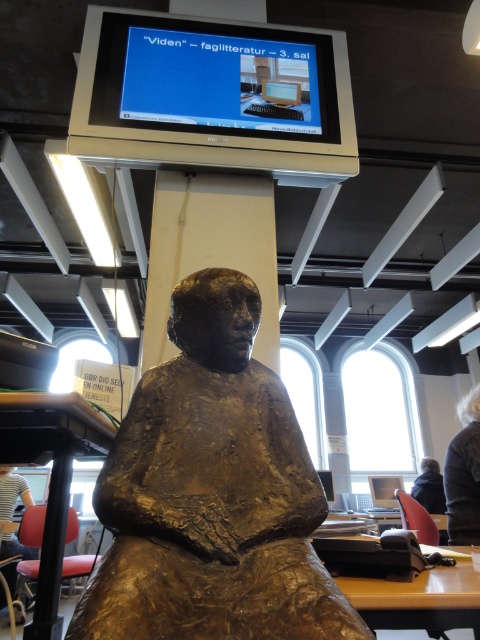
Is black matte table at lower left shorter than wooden table at lower center?

No.

Between black matte table at lower left and wooden table at lower center, which one has more height?

With more height is black matte table at lower left.

Find the location of a particular element. The height and width of the screenshot is (640, 480). black matte table at lower left is located at coordinates (50, 476).

Can you confirm if wooden table at lower center is wider than dark brown hair at lower right?

Yes, wooden table at lower center is wider than dark brown hair at lower right.

Does wooden table at lower center have a greater height compared to dark brown hair at lower right?

Incorrect, wooden table at lower center's height is not larger of dark brown hair at lower right's.

Describe the element at coordinates (400, 586) in the screenshot. Image resolution: width=480 pixels, height=640 pixels. I see `wooden table at lower center` at that location.

At what (x,y) coordinates should I click in order to perform the action: click on wooden table at lower center. Please return your answer as a coordinate pair (x, y). The image size is (480, 640). Looking at the image, I should click on (400, 586).

Is the position of bronze statue at center more distant than that of dark brown hair at lower right?

No, it is in front of dark brown hair at lower right.

Does bronze statue at center have a lesser height compared to dark brown hair at lower right?

In fact, bronze statue at center may be taller than dark brown hair at lower right.

This screenshot has width=480, height=640. Describe the element at coordinates (211, 493) in the screenshot. I see `bronze statue at center` at that location.

Locate an element on the screen. bronze statue at center is located at coordinates (211, 493).